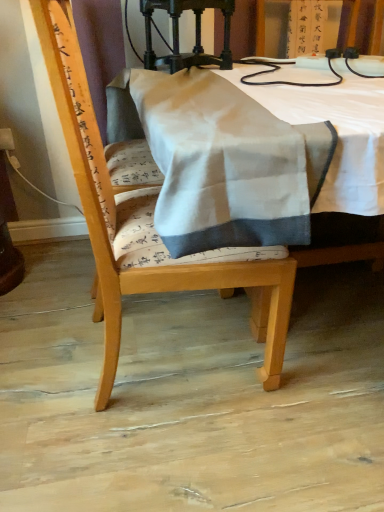
Question: Is white fabric at center positioned with its back to wooden chair at center?

Choices:
 (A) no
 (B) yes

Answer: (A)

Question: Is white fabric at center at the left side of wooden chair at center?

Choices:
 (A) yes
 (B) no

Answer: (B)

Question: Does white fabric at center appear on the right side of wooden chair at center?

Choices:
 (A) no
 (B) yes

Answer: (B)

Question: Is white fabric at center outside wooden chair at center?

Choices:
 (A) yes
 (B) no

Answer: (A)

Question: Is wooden chair at center a part of white fabric at center?

Choices:
 (A) yes
 (B) no

Answer: (A)

Question: Does white fabric at center turn towards wooden chair at center?

Choices:
 (A) yes
 (B) no

Answer: (B)

Question: Is white fabric at center at the back of wooden chair at center?

Choices:
 (A) yes
 (B) no

Answer: (A)

Question: Could you tell me if wooden chair at center is facing white fabric at center?

Choices:
 (A) no
 (B) yes

Answer: (B)

Question: Is wooden chair at center positioned before white fabric at center?

Choices:
 (A) yes
 (B) no

Answer: (B)

Question: Is white fabric at center completely or partially inside wooden chair at center?

Choices:
 (A) no
 (B) yes

Answer: (A)

Question: Is wooden chair at center to the left of white fabric at center from the viewer's perspective?

Choices:
 (A) no
 (B) yes

Answer: (B)

Question: Are wooden chair at center and white fabric at center beside each other?

Choices:
 (A) no
 (B) yes

Answer: (A)

Question: From a real-world perspective, does wooden chair at center sit lower than polished dark wood lamp at upper center?

Choices:
 (A) yes
 (B) no

Answer: (A)